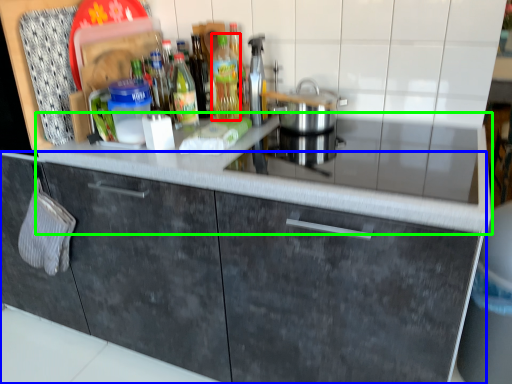
Question: Which object is positioned farthest from bottle (highlighted by a red box)? Select from cabinetry (highlighted by a blue box) and countertop (highlighted by a green box).

Choices:
 (A) cabinetry
 (B) countertop

Answer: (A)